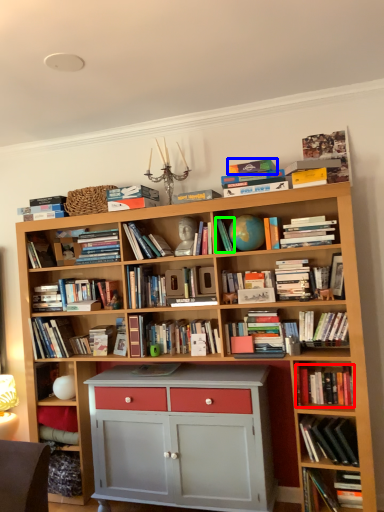
Question: Which object is positioned farthest from book (highlighted by a red box)? Select from paperback book (highlighted by a blue box) and book (highlighted by a green box).

Choices:
 (A) paperback book
 (B) book

Answer: (A)